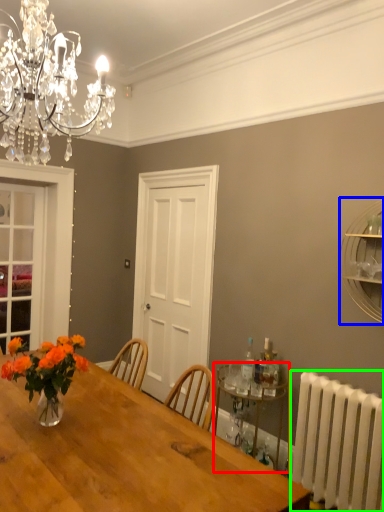
Question: Estimate the real-world distances between objects in this image. Which object is farther from shelf (highlighted by a red box), shelf (highlighted by a blue box) or radiator (highlighted by a green box)?

Choices:
 (A) shelf
 (B) radiator

Answer: (A)